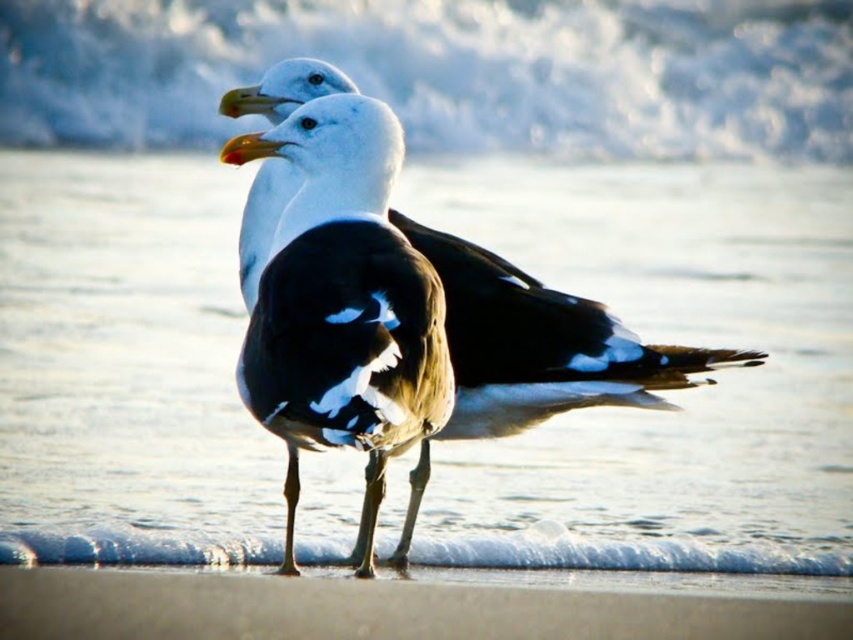
Question: Which point appears closest to the camera in this image?

Choices:
 (A) (164, 541)
 (B) (602, 138)
 (C) (256, 140)

Answer: (C)

Question: Is clear water at center smaller than white frothy wave at upper center?

Choices:
 (A) no
 (B) yes

Answer: (A)

Question: Which of these objects is positioned farthest from the yellow-orange beak at center?

Choices:
 (A) white frothy wave at upper center
 (B) clear water at center

Answer: (B)

Question: Does clear water at center appear on the right side of yellow-orange beak at center?

Choices:
 (A) yes
 (B) no

Answer: (A)

Question: Does white frothy wave at upper center have a lesser width compared to yellow-orange beak at center?

Choices:
 (A) no
 (B) yes

Answer: (A)

Question: Which object appears farthest from the camera in this image?

Choices:
 (A) yellow-orange beak at center
 (B) white frothy wave at upper center
 (C) clear water at center

Answer: (A)